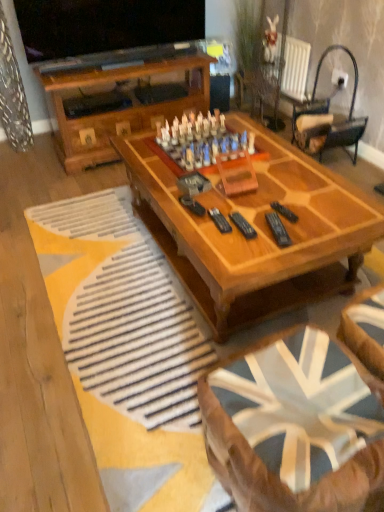
You are a GUI agent. You are given a task and a screenshot of the screen. Output one action in this format:
    pyautogui.click(x=<x>, y=<y>)
    Task: Click on the vacant area that is in front of black plastic remote at center, the 3th remote viewed from the left
    The height and width of the screenshot is (512, 384).
    Given the screenshot: What is the action you would take?
    pyautogui.click(x=290, y=237)